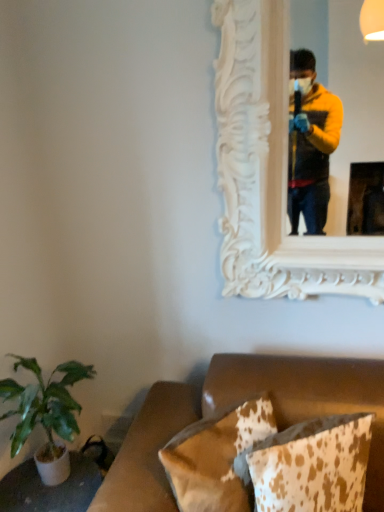
Question: From a real-world perspective, is green leafy plant at lower left on top of cowhide pillow at lower right, the first pillow when ordered from right to left?

Choices:
 (A) yes
 (B) no

Answer: (A)

Question: Is green leafy plant at lower left next to cowhide pillow at lower right, the first pillow when ordered from right to left, and touching it?

Choices:
 (A) no
 (B) yes

Answer: (A)

Question: Is green leafy plant at lower left closer to the viewer compared to cowhide pillow at lower right, which ranks as the second pillow in left-to-right order?

Choices:
 (A) yes
 (B) no

Answer: (B)

Question: Is the position of green leafy plant at lower left more distant than that of cowhide pillow at lower right, the first pillow when ordered from right to left?

Choices:
 (A) no
 (B) yes

Answer: (B)

Question: Would you say cowhide pillow at lower right, the first pillow when ordered from right to left, is part of green leafy plant at lower left's contents?

Choices:
 (A) yes
 (B) no

Answer: (B)

Question: Considering the relative sizes of green leafy plant at lower left and cowhide pillow at lower right, the first pillow when ordered from right to left, in the image provided, is green leafy plant at lower left thinner than cowhide pillow at lower right, the first pillow when ordered from right to left,?

Choices:
 (A) yes
 (B) no

Answer: (B)

Question: Is white carved wood mirror at upper center at the back of green leafy plant at lower left?

Choices:
 (A) yes
 (B) no

Answer: (B)

Question: From a real-world perspective, is green leafy plant at lower left positioned under white carved wood mirror at upper center based on gravity?

Choices:
 (A) yes
 (B) no

Answer: (A)

Question: Can you confirm if green leafy plant at lower left is shorter than white carved wood mirror at upper center?

Choices:
 (A) no
 (B) yes

Answer: (B)

Question: Is green leafy plant at lower left at the right side of white carved wood mirror at upper center?

Choices:
 (A) no
 (B) yes

Answer: (A)

Question: Are green leafy plant at lower left and white carved wood mirror at upper center located far from each other?

Choices:
 (A) yes
 (B) no

Answer: (B)

Question: Can you confirm if green leafy plant at lower left is thinner than white carved wood mirror at upper center?

Choices:
 (A) yes
 (B) no

Answer: (B)

Question: Considering the relative sizes of brown cowhide pillow at lower center, which ranks as the 1th pillow in left-to-right order, and cowhide pillow at lower right, which ranks as the second pillow in left-to-right order, in the image provided, is brown cowhide pillow at lower center, which ranks as the 1th pillow in left-to-right order, smaller than cowhide pillow at lower right, which ranks as the second pillow in left-to-right order,?

Choices:
 (A) no
 (B) yes

Answer: (A)